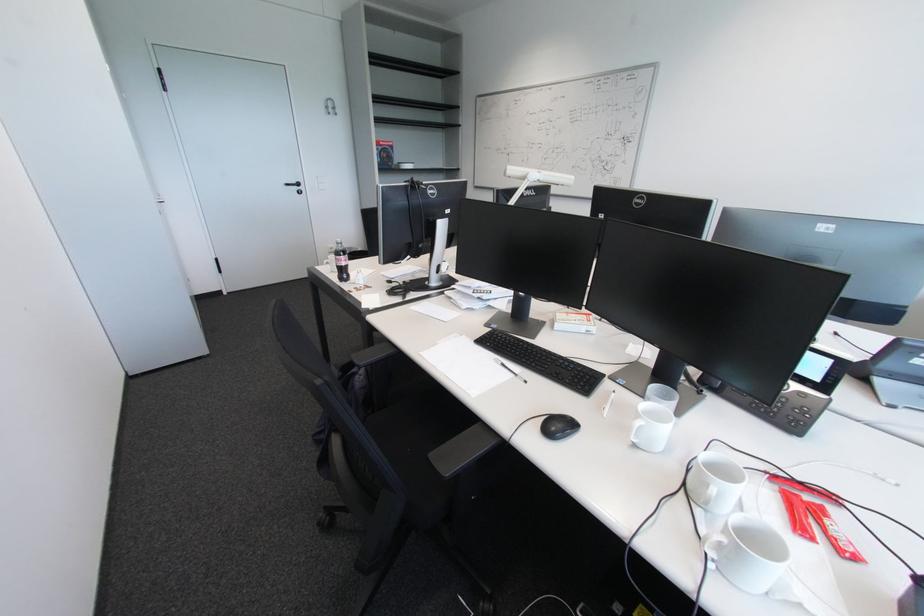
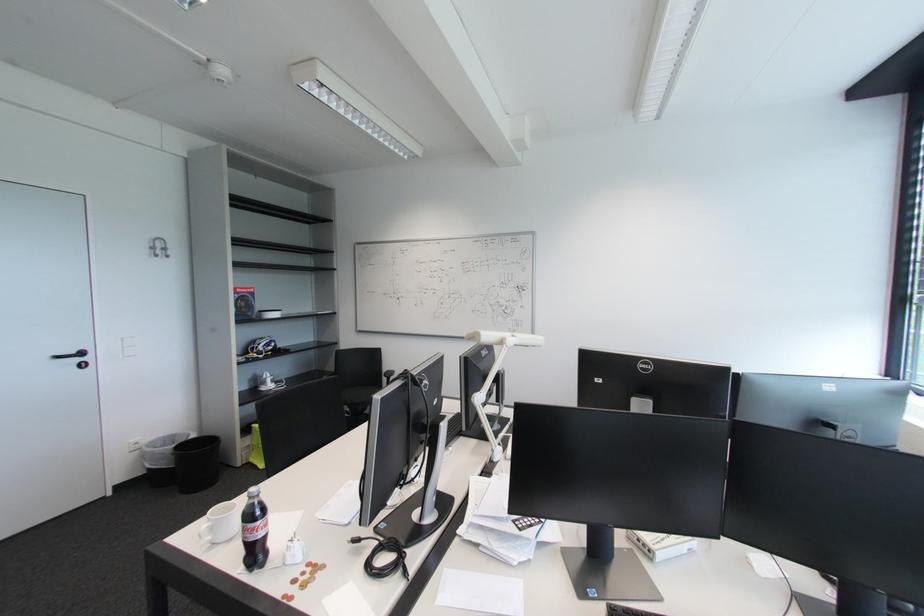
Locate, in the second image, the point that corresponds to point 347,257 in the first image.

(262, 521)